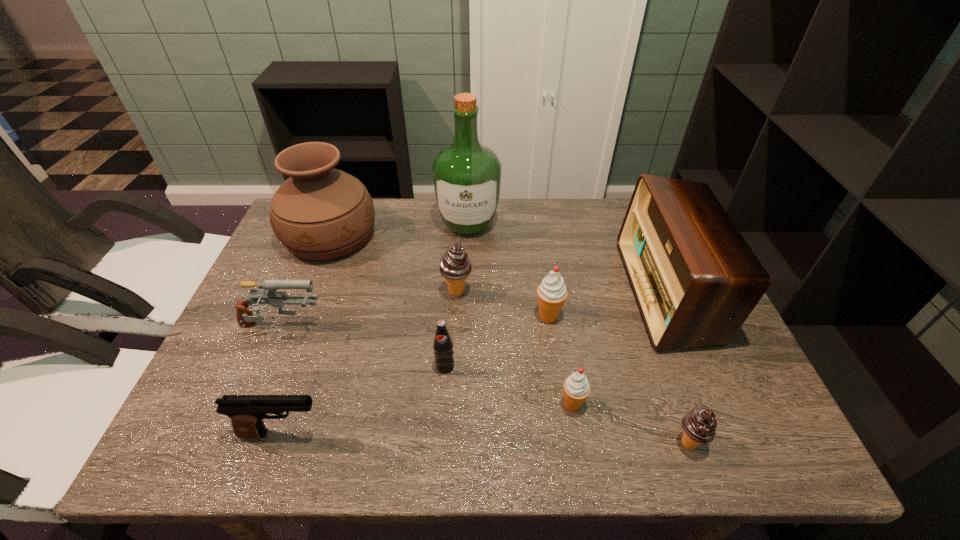
Identify the location of radio receiver positioned at the far edge. pyautogui.click(x=695, y=279).

Find the location of a particular element. This screenshot has width=960, height=540. pistol present at the near edge is located at coordinates (247, 412).

Locate an element on the screen. Image resolution: width=960 pixels, height=540 pixels. urn positioned at the left edge is located at coordinates (319, 213).

At what (x,y) coordinates should I click in order to perform the action: click on gun situated at the left edge. Please return your answer as a coordinate pair (x, y). The image size is (960, 540). Looking at the image, I should click on (267, 291).

I want to click on pistol that is at the left edge, so click(247, 412).

Where is `radio receiver that is at the right edge`? radio receiver that is at the right edge is located at coordinates (695, 279).

Locate an element on the screen. The width and height of the screenshot is (960, 540). icecream at the right edge is located at coordinates (699, 425).

The height and width of the screenshot is (540, 960). I want to click on object that is at the far left corner, so click(x=319, y=213).

Identify the location of object present at the near left corner. This screenshot has width=960, height=540. (247, 412).

I want to click on object that is at the far right corner, so click(695, 279).